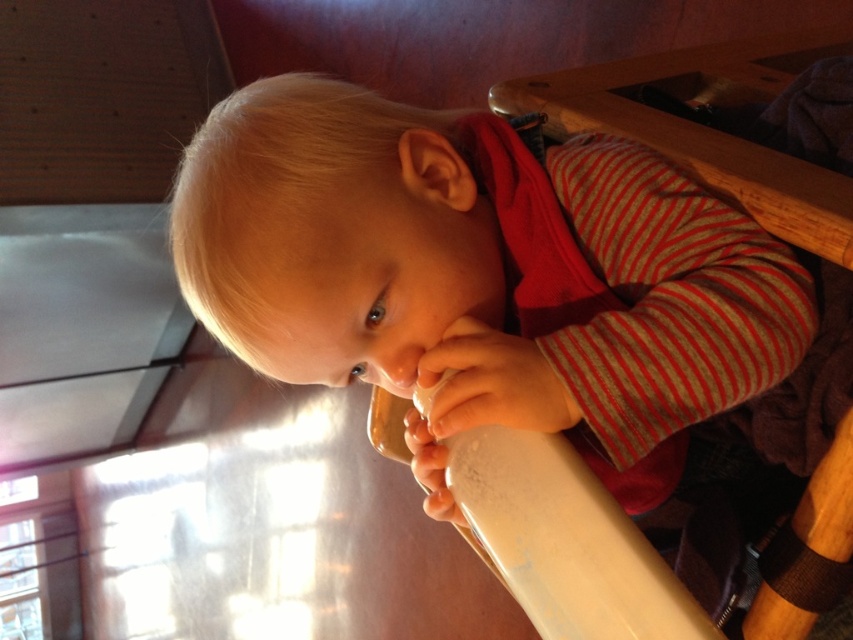
Is white plastic cup at center above white matte hand at lower center?

Correct, white plastic cup at center is located above white matte hand at lower center.

Between point (328, 310) and point (425, 436), which one is positioned in front?

Point (328, 310) is more forward.

Identify the location of white plastic cup at center. This screenshot has height=640, width=853. 483,273.

Between point (448, 419) and point (421, 440), which one is positioned in front?

Point (448, 419) is more forward.

Between smooth white hand at center and white matte hand at lower center, which one is positioned higher?

smooth white hand at center is higher up.

Is point (460, 392) closer to camera compared to point (440, 518)?

Yes.

Find the location of a particular element. Image resolution: width=853 pixels, height=640 pixels. smooth white hand at center is located at coordinates (488, 385).

Is white plastic cup at center further to camera compared to smooth white hand at center?

No, white plastic cup at center is closer to the viewer.

Who is positioned more to the left, white plastic cup at center or smooth white hand at center?

smooth white hand at center is more to the left.

I want to click on white plastic cup at center, so click(483, 273).